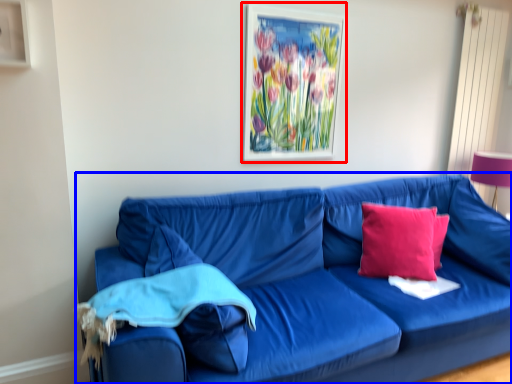
Question: Which point is closer to the camera, picture frame (highlighted by a red box) or studio couch (highlighted by a blue box)?

Choices:
 (A) picture frame
 (B) studio couch

Answer: (B)